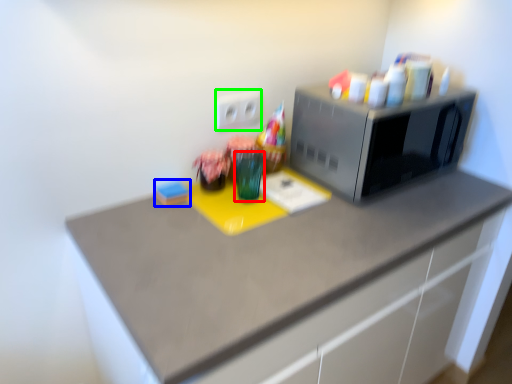
Question: Which object is the farthest from glass vase (highlighted by a red box)? Choose among these: stationery (highlighted by a blue box) or electric outlet (highlighted by a green box).

Choices:
 (A) stationery
 (B) electric outlet

Answer: (A)